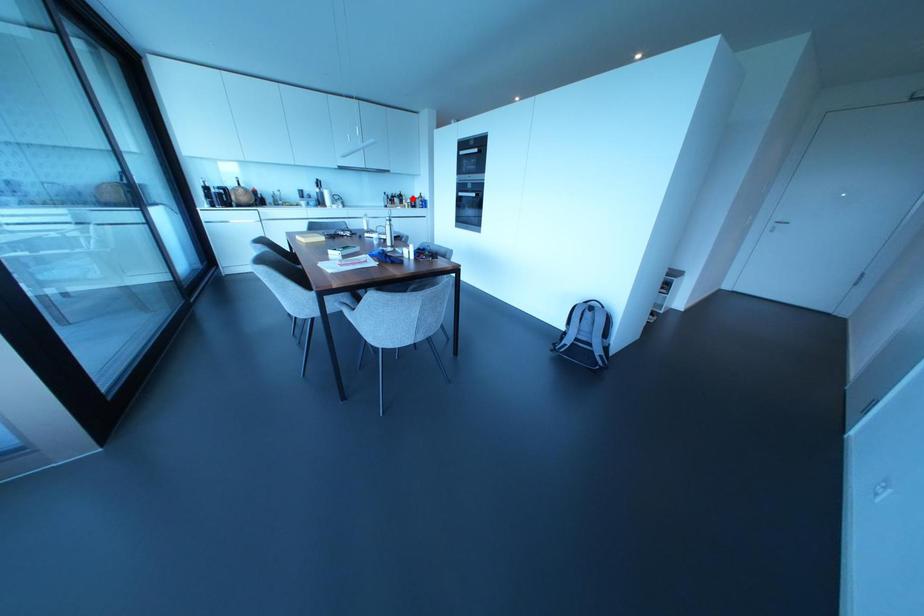
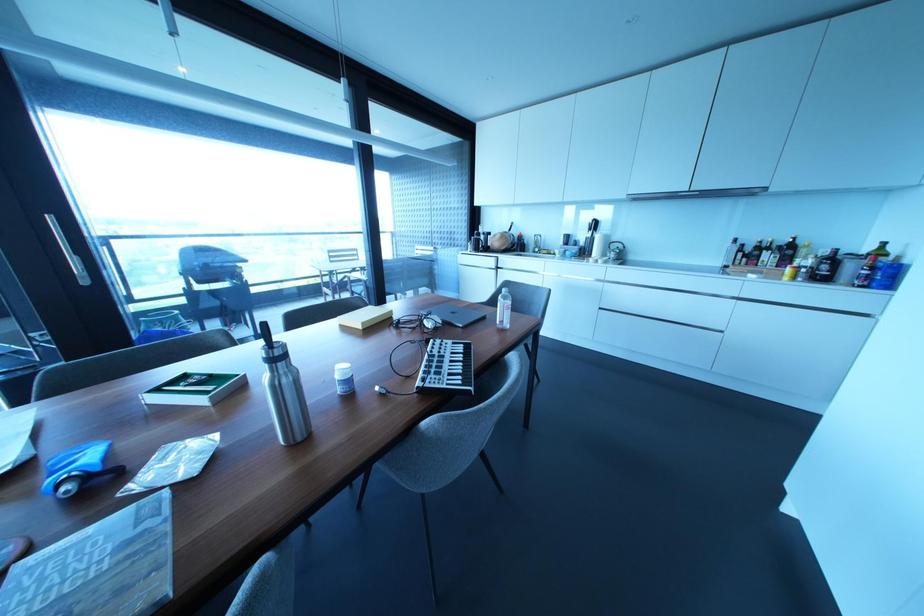
Where in the second image is the point corresponding to the highlighted location from the first image?

(833, 257)